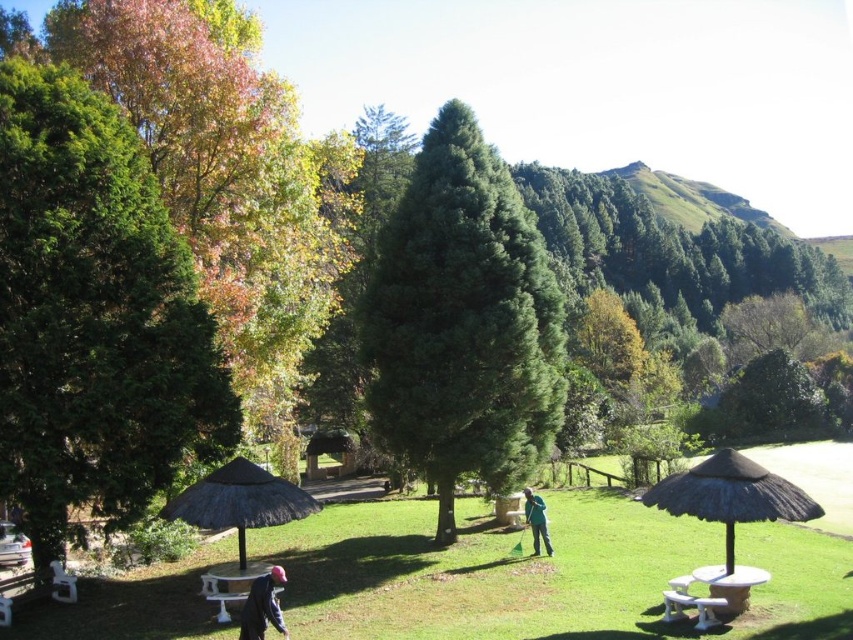
Question: Which point appears farthest from the camera in this image?

Choices:
 (A) (229, 616)
 (B) (544, 326)

Answer: (B)

Question: Considering the relative positions of black thatched umbrella at lower right and brown thatched hut at center in the image provided, where is black thatched umbrella at lower right located with respect to brown thatched hut at center?

Choices:
 (A) above
 (B) below

Answer: (A)

Question: Which is farther from the green matte tree at center?

Choices:
 (A) black thatched umbrella at lower right
 (B) dark blue jacket at lower left

Answer: (B)

Question: Is white plastic table at center to the right of white plastic picnic table at lower right from the viewer's perspective?

Choices:
 (A) no
 (B) yes

Answer: (B)

Question: Can you confirm if white plastic table at center is positioned to the left of white glossy picnic table at lower left?

Choices:
 (A) yes
 (B) no

Answer: (B)

Question: Which point appears closest to the camera in this image?

Choices:
 (A) (741, 460)
 (B) (596, 608)
 (C) (300, 513)
 (D) (476, 240)

Answer: (A)